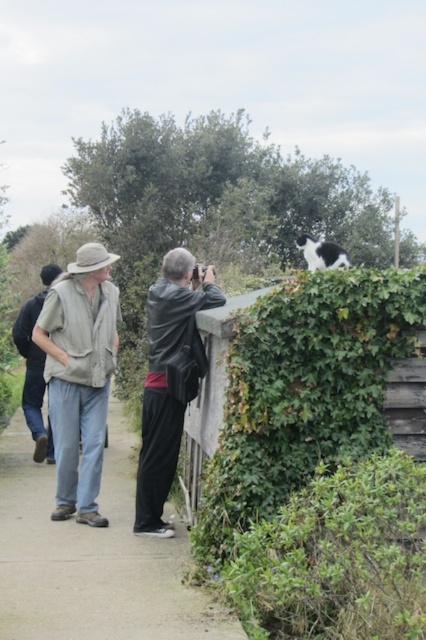
You are standing at the edge of the scene and want to walk towards the concrete sidewalk at lower center and the light brown fabric shirt at left. Which object will you reach first?

The concrete sidewalk at lower center is closer to the viewer than the light brown fabric shirt at left, so you will reach the concrete sidewalk at lower center first.

You are standing at the camera position and want to walk to one of the two points in the image. Which point, point (356, 392) or point (29, 369), is closer to you?

Point (356, 392) is closer to the camera than point (29, 369).

You are standing at the entrance of the park and see the green ivy hedge at upper right and the black leather jacket at center. Which object is closer to you?

The green ivy hedge at upper right is closer to you because it is in front of the black leather jacket at center.